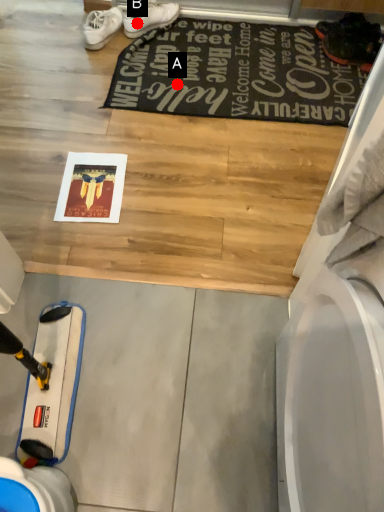
Question: Two points are circled on the image, labeled by A and B beside each circle. Which point is farther from the camera taking this photo?

Choices:
 (A) A is further
 (B) B is further

Answer: (B)